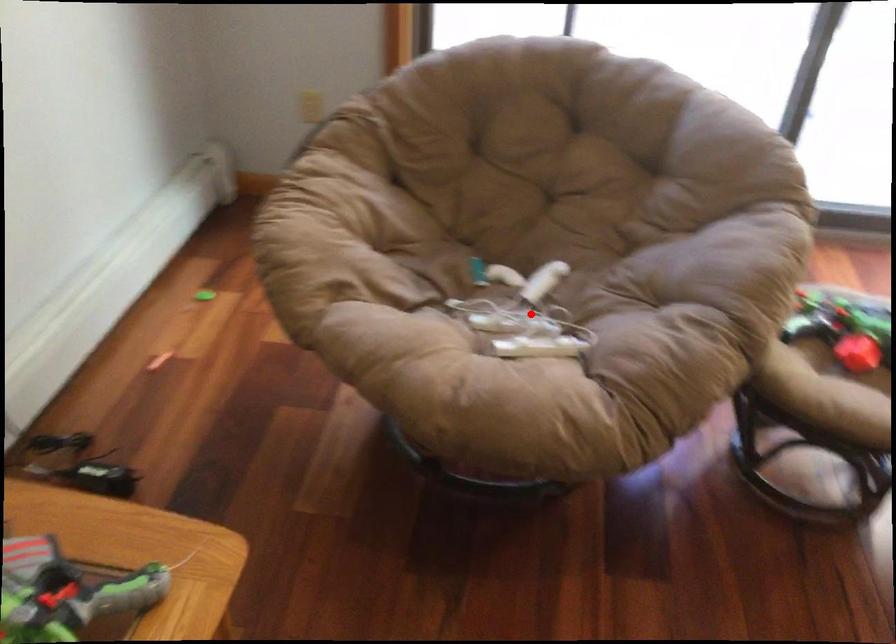
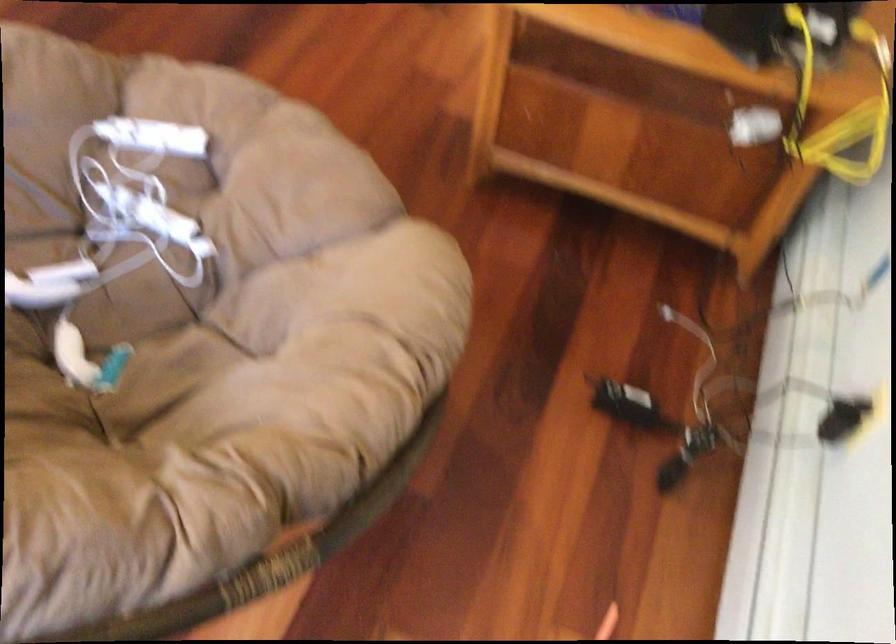
In the second image, find the point that corresponds to the highlighted location in the first image.

(113, 236)